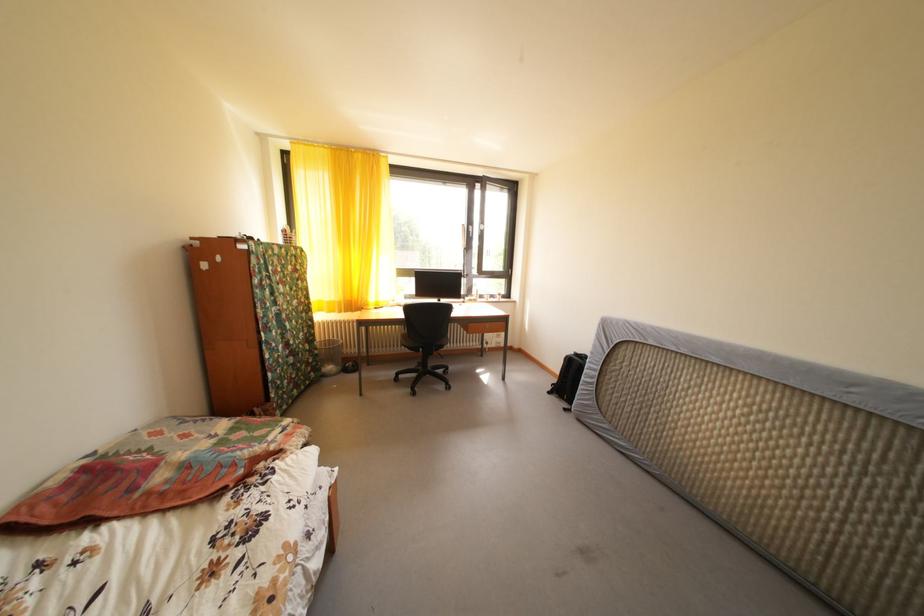
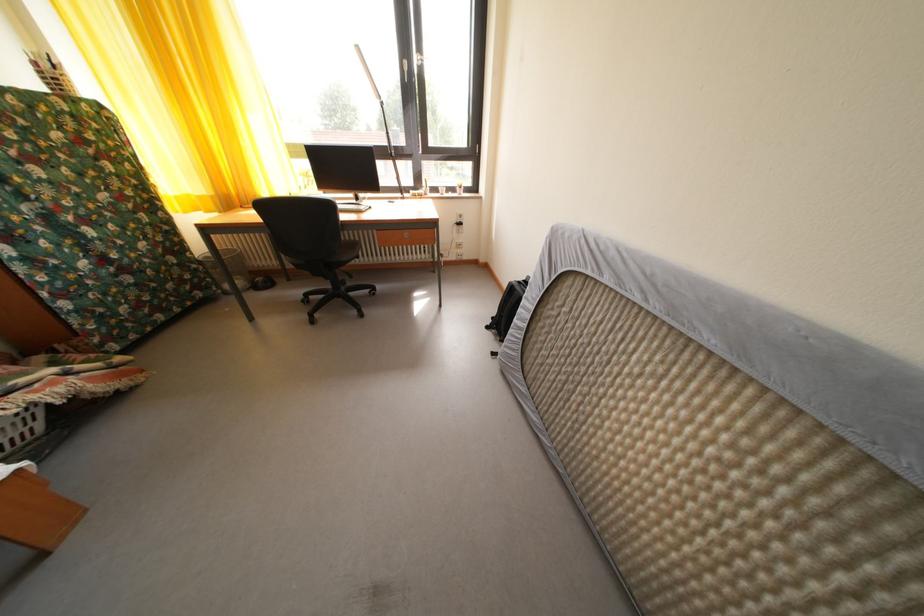
The point at [660,349] is marked in the first image. Where is the corresponding point in the second image?

(615, 285)